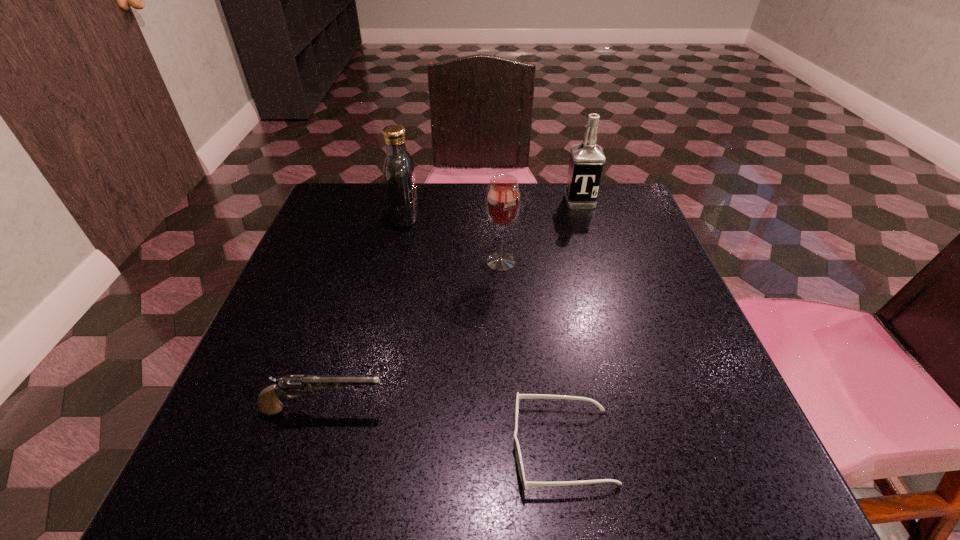
Find the location of `free location located 0.200m with the lenses of the sunglasses facing outward`. free location located 0.200m with the lenses of the sunglasses facing outward is located at coordinates (378, 447).

The image size is (960, 540). In order to click on free region located with the lenses of the sunglasses facing outward in this screenshot , I will do `click(358, 447)`.

Where is `object that is at the near edge`? The image size is (960, 540). object that is at the near edge is located at coordinates (524, 483).

Locate an element on the screen. Image resolution: width=960 pixels, height=540 pixels. object that is positioned at the left edge is located at coordinates (268, 403).

Where is `object located in the right edge section of the desktop`? object located in the right edge section of the desktop is located at coordinates (586, 163).

Identify the location of object present at the far right corner. (586, 163).

Locate an element on the screen. free space at the far edge is located at coordinates (466, 226).

At what (x,y) coordinates should I click in order to perform the action: click on vacant space at the near edge of the desktop. Please return your answer as a coordinate pair (x, y). The height and width of the screenshot is (540, 960). Looking at the image, I should click on click(361, 438).

Find the location of a particular element. vacant space at the left edge of the desktop is located at coordinates (278, 336).

Identify the location of free space at the right edge of the desktop. Image resolution: width=960 pixels, height=540 pixels. (635, 380).